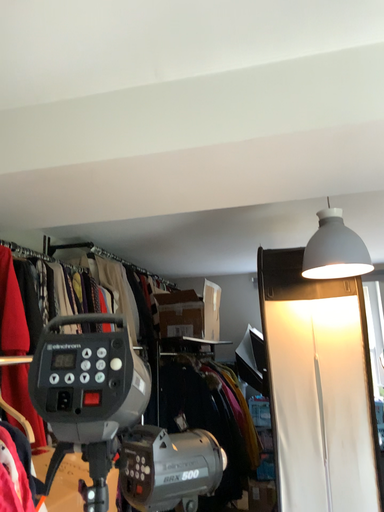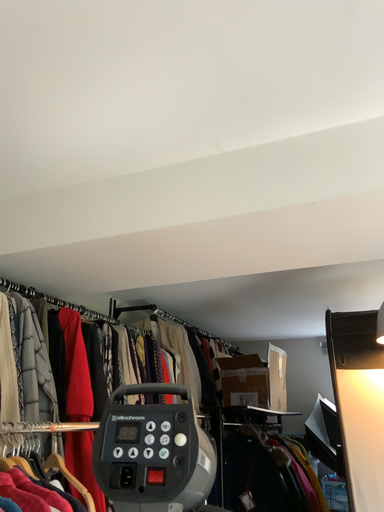
Question: How did the camera likely rotate when shooting the video?

Choices:
 (A) rotated downward
 (B) rotated upward

Answer: (B)